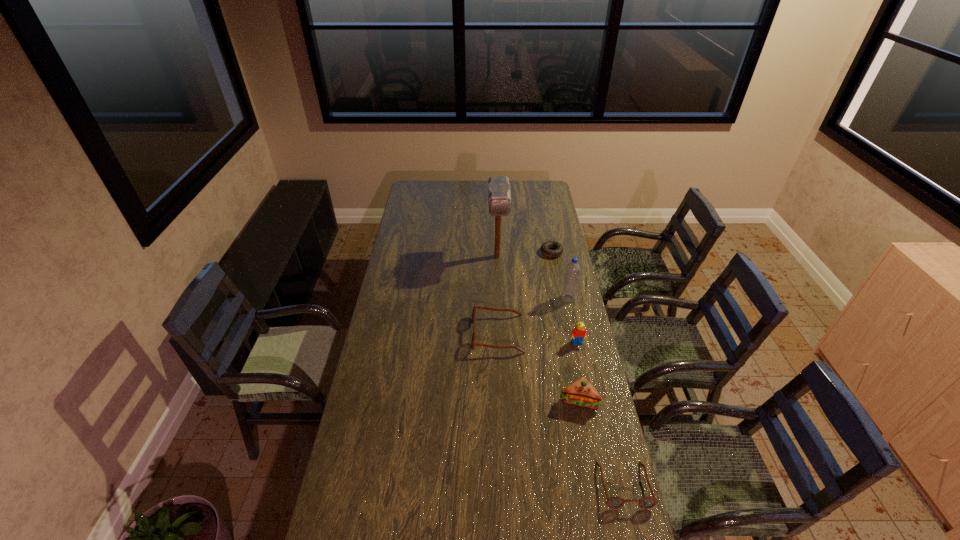
The height and width of the screenshot is (540, 960). What are the coordinates of `vacant space located 0.200m on the front-facing side of the third shortest object` in the screenshot? It's located at (424, 334).

At what (x,y) coordinates should I click in order to perform the action: click on vacant region located 0.270m on the front-facing side of the third shortest object. Please return your answer as a coordinate pair (x, y). This screenshot has width=960, height=540. Looking at the image, I should click on (408, 334).

Find the location of a particular element. This screenshot has width=960, height=540. vacant point located 0.270m on the front-facing side of the third shortest object is located at coordinates (408, 334).

Locate an element on the screen. free space located 0.060m on the front-facing side of the right spectacles is located at coordinates (635, 531).

Locate an element on the screen. The image size is (960, 540). vacant point located on the back of the doughnut is located at coordinates (546, 224).

What are the coordinates of `vacant space located 0.190m on the striking face of the tallest object` in the screenshot? It's located at (499, 296).

At what (x,y) coordinates should I click in order to perform the action: click on vacant area situated 0.190m on the front of the sandwich. Please return your answer as a coordinate pair (x, y). The image size is (960, 540). Looking at the image, I should click on [x=591, y=464].

The height and width of the screenshot is (540, 960). Find the location of `free space located on the front of the water bottle`. free space located on the front of the water bottle is located at coordinates (577, 340).

Find the location of a particular element. free space located 0.270m on the face of the Lego is located at coordinates (590, 404).

The height and width of the screenshot is (540, 960). I want to click on object situated at the near edge, so [616, 502].